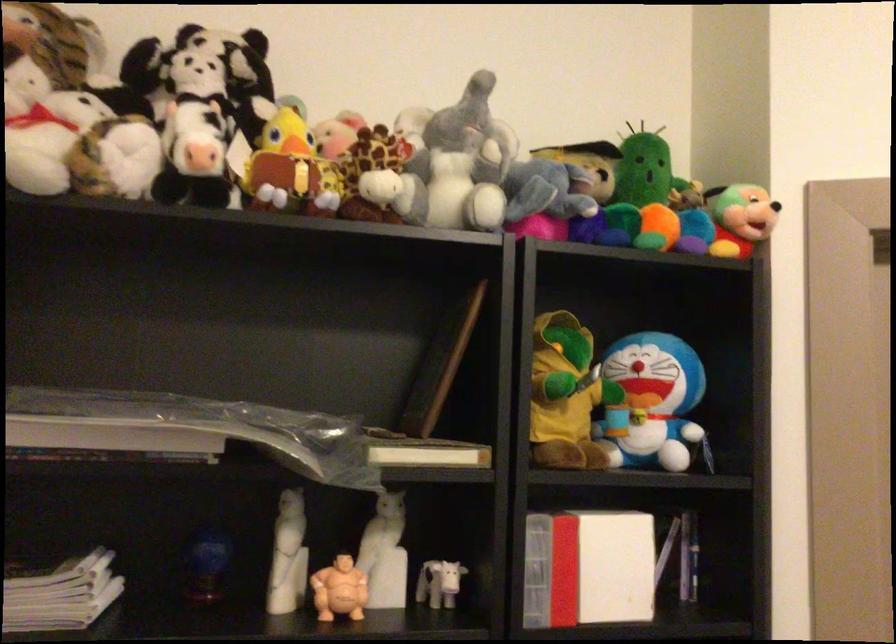
Identify the location of green frog toy. This screenshot has width=896, height=644. (565, 395).